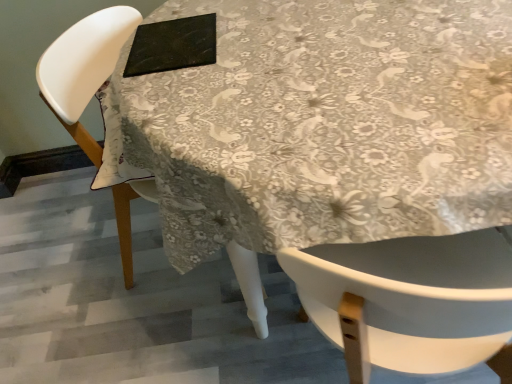
This screenshot has height=384, width=512. Find the location of `vacant space behind black matte pad at upper center`. vacant space behind black matte pad at upper center is located at coordinates (179, 13).